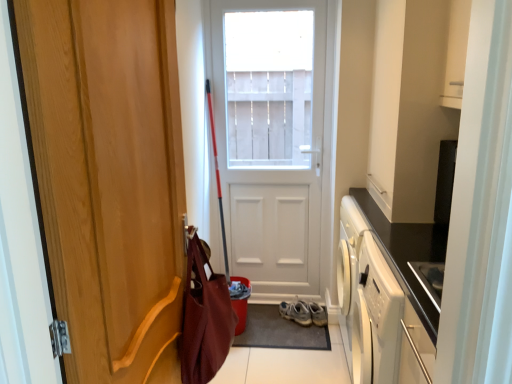
Question: Is maroon fabric messenger bag at left turned away from white matte cabinet at upper right?

Choices:
 (A) no
 (B) yes

Answer: (A)

Question: Does maroon fabric messenger bag at left come behind white matte cabinet at upper right?

Choices:
 (A) yes
 (B) no

Answer: (B)

Question: Is maroon fabric messenger bag at left positioned before white matte cabinet at upper right?

Choices:
 (A) no
 (B) yes

Answer: (B)

Question: Does maroon fabric messenger bag at left appear on the right side of white matte cabinet at upper right?

Choices:
 (A) no
 (B) yes

Answer: (A)

Question: Is maroon fabric messenger bag at left taller than white matte cabinet at upper right?

Choices:
 (A) yes
 (B) no

Answer: (B)

Question: Is dark gray rubber doormat at center situated inside wooden door at left, the first door viewed from the front, or outside?

Choices:
 (A) outside
 (B) inside

Answer: (A)

Question: In terms of width, does dark gray rubber doormat at center look wider or thinner when compared to wooden door at left, the first door viewed from the front?

Choices:
 (A) thin
 (B) wide

Answer: (B)

Question: Relative to wooden door at left, which is the 1th door from left to right, is dark gray rubber doormat at center in front or behind?

Choices:
 (A) behind
 (B) front

Answer: (A)

Question: In terms of size, does dark gray rubber doormat at center appear bigger or smaller than wooden door at left, which is the 1th door from left to right?

Choices:
 (A) big
 (B) small

Answer: (B)

Question: Is point click(x=135, y=147) positioned closer to the camera than point click(x=322, y=324)?

Choices:
 (A) farther
 (B) closer

Answer: (B)

Question: Based on their sizes in the image, would you say wooden door at left, which is the 1th door from left to right, is bigger or smaller than gray suede sneakers at lower center?

Choices:
 (A) small
 (B) big

Answer: (B)

Question: From a real-world perspective, relative to gray suede sneakers at lower center, is wooden door at left, which is the 2th door in back-to-front order, vertically above or below?

Choices:
 (A) above
 (B) below

Answer: (A)

Question: Is wooden door at left, which is the 2th door in back-to-front order, inside or outside of gray suede sneakers at lower center?

Choices:
 (A) inside
 (B) outside

Answer: (B)

Question: Is gray suede sneakers at lower center wider or thinner than dark gray rubber doormat at center?

Choices:
 (A) wide
 (B) thin

Answer: (B)

Question: Looking at the image, does gray suede sneakers at lower center seem bigger or smaller compared to dark gray rubber doormat at center?

Choices:
 (A) small
 (B) big

Answer: (A)